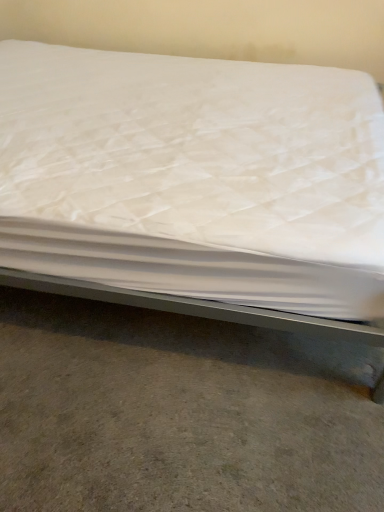
Question: Based on their sizes in the image, would you say gray concrete floor at lower center is bigger or smaller than white quilted mattress at center?

Choices:
 (A) small
 (B) big

Answer: (A)

Question: Is gray concrete floor at lower center in front of or behind white quilted mattress at center in the image?

Choices:
 (A) behind
 (B) front

Answer: (A)

Question: Does point (125, 480) appear closer or farther from the camera than point (31, 216)?

Choices:
 (A) closer
 (B) farther

Answer: (A)

Question: From the image's perspective, is white quilted mattress at center located above or below gray concrete floor at lower center?

Choices:
 (A) below
 (B) above

Answer: (B)

Question: Would you say white quilted mattress at center is to the left or to the right of gray concrete floor at lower center in the picture?

Choices:
 (A) left
 (B) right

Answer: (A)

Question: From a real-world perspective, is white quilted mattress at center positioned above or below gray concrete floor at lower center?

Choices:
 (A) below
 (B) above

Answer: (B)

Question: Considering their positions, is white quilted mattress at center located in front of or behind gray concrete floor at lower center?

Choices:
 (A) behind
 (B) front

Answer: (B)